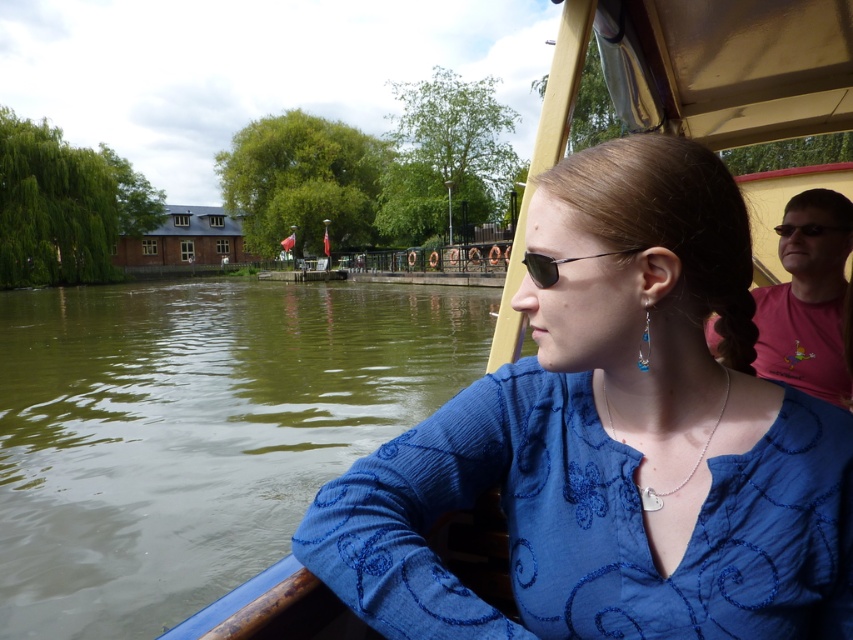
You are a passenger on the canal boat and want to hand your blue knitted sweater at center to someone standing on the dock. Can you reach them without leaving the boat?

The distance between you and the person on the dock is 35.99 inches, so you can reach them easily as the distance is within arm reach.